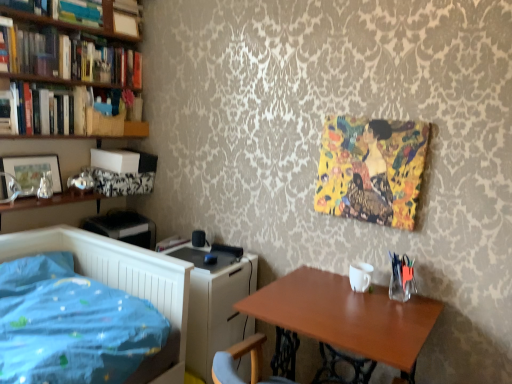
Question: Is yellow fabric painting at upper right looking in the opposite direction of white glossy computer desk at center?

Choices:
 (A) no
 (B) yes

Answer: (A)

Question: From the image's perspective, is yellow fabric painting at upper right located above white glossy computer desk at center?

Choices:
 (A) yes
 (B) no

Answer: (A)

Question: Is yellow fabric painting at upper right facing towards white glossy computer desk at center?

Choices:
 (A) yes
 (B) no

Answer: (B)

Question: Is yellow fabric painting at upper right positioned beyond the bounds of white glossy computer desk at center?

Choices:
 (A) no
 (B) yes

Answer: (B)

Question: Considering the relative sizes of yellow fabric painting at upper right and white glossy computer desk at center in the image provided, is yellow fabric painting at upper right shorter than white glossy computer desk at center?

Choices:
 (A) yes
 (B) no

Answer: (A)

Question: Does yellow fabric painting at upper right have a greater height compared to white glossy computer desk at center?

Choices:
 (A) no
 (B) yes

Answer: (A)

Question: Considering the relative positions of hardcover books at upper left, which is counted as the fourth book, starting from the bottom, and matte white book at upper left, which is the 6th book from bottom to top, in the image provided, is hardcover books at upper left, which is counted as the fourth book, starting from the bottom, to the left of matte white book at upper left, which is the 6th book from bottom to top, from the viewer's perspective?

Choices:
 (A) no
 (B) yes

Answer: (B)

Question: Is hardcover books at upper left, which is counted as the third book, starting from the top, taller than matte white book at upper left, which is the 1th book in top-to-bottom order?

Choices:
 (A) yes
 (B) no

Answer: (B)

Question: Can you confirm if hardcover books at upper left, which is counted as the fourth book, starting from the bottom, is bigger than matte white book at upper left, which is the 1th book in top-to-bottom order?

Choices:
 (A) no
 (B) yes

Answer: (B)

Question: From the image's perspective, would you say hardcover books at upper left, which is counted as the third book, starting from the top, is shown under matte white book at upper left, which is the 6th book from bottom to top?

Choices:
 (A) no
 (B) yes

Answer: (B)

Question: Is hardcover books at upper left, which is counted as the third book, starting from the top, facing towards matte white book at upper left, which is the 1th book in top-to-bottom order?

Choices:
 (A) yes
 (B) no

Answer: (B)

Question: From a real-world perspective, is hardcover books at upper left, which is counted as the fourth book, starting from the bottom, beneath matte white book at upper left, which is the 6th book from bottom to top?

Choices:
 (A) yes
 (B) no

Answer: (A)

Question: Is yellow fabric painting at upper right outside of hardcover books at left, the fifth book from the top?

Choices:
 (A) no
 (B) yes

Answer: (B)